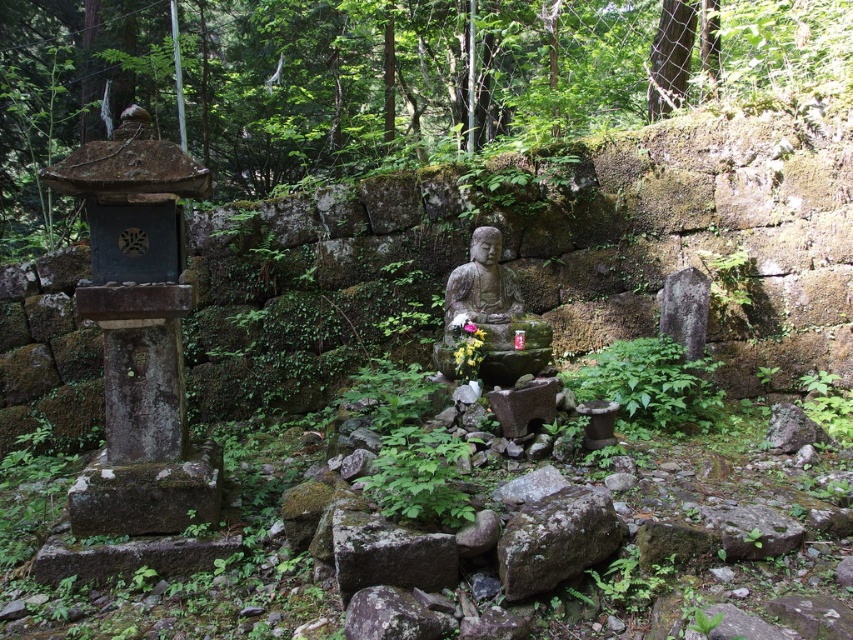
Who is taller, green mossy rock at center or gray rough stone at lower right?

Standing taller between the two is green mossy rock at center.

Is point (579, 518) positioned before point (762, 536)?

Yes, it is.

Which is behind, point (563, 509) or point (711, 528)?

Positioned behind is point (711, 528).

Identify the location of green mossy rock at center. Image resolution: width=853 pixels, height=640 pixels. (556, 540).

Can you confirm if green mossy stone wall at center is positioned above gray rough stone at lower right?

Indeed, green mossy stone wall at center is positioned over gray rough stone at lower right.

Does point (210, 268) come behind point (762, 528)?

Yes, it is behind point (762, 528).

Does point (717, 145) come behind point (773, 545)?

Yes, point (717, 145) is behind point (773, 545).

Image resolution: width=853 pixels, height=640 pixels. Identify the location of green mossy stone wall at center. (537, 259).

Can you confirm if gray rough stone at lower right is thinner than pink matte flower at center?

No.

Is point (735, 541) positioned in front of point (463, 323)?

Yes.

At what (x,y) coordinates should I click in order to perform the action: click on gray rough stone at lower right. Please return your answer as a coordinate pair (x, y). The image size is (853, 640). Looking at the image, I should click on (752, 531).